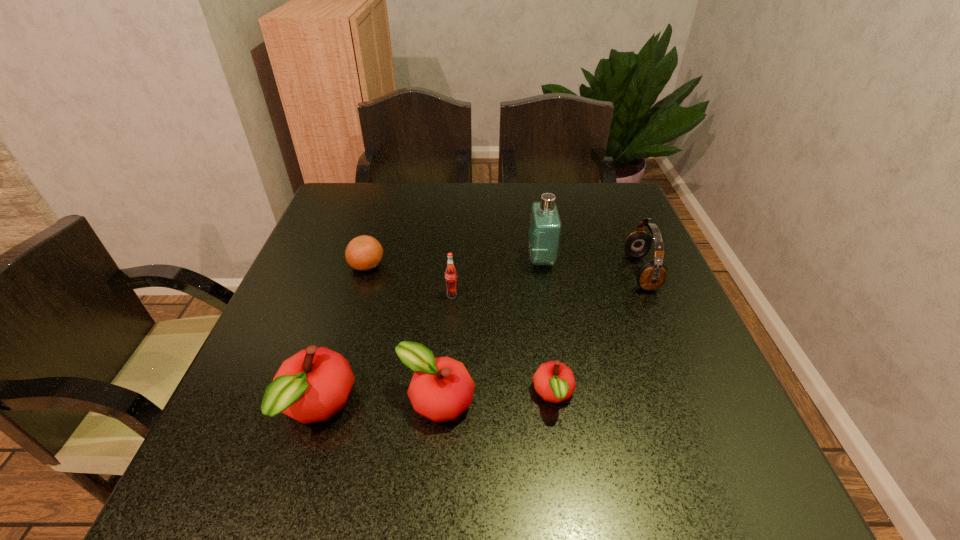
Where is `clementine that is at the left edge`? Image resolution: width=960 pixels, height=540 pixels. clementine that is at the left edge is located at coordinates (363, 253).

Locate an element on the screen. This screenshot has height=540, width=960. object located in the right edge section of the desktop is located at coordinates (652, 275).

Locate an element on the screen. Image resolution: width=960 pixels, height=540 pixels. object present at the near left corner is located at coordinates (311, 386).

The image size is (960, 540). Identify the location of free spot at the far edge of the desktop. (476, 204).

This screenshot has height=540, width=960. Identify the location of free space at the near edge. (492, 414).

Locate an element on the screen. free space at the left edge of the desktop is located at coordinates (334, 284).

Find the location of a particular element. Image resolution: width=960 pixels, height=540 pixels. blank space at the right edge is located at coordinates (662, 301).

You are a GUI agent. You are given a task and a screenshot of the screen. Output one action in this format:
    pyautogui.click(x=<x>, y=<y>)
    Task: Click on the vacant space at the far right corner of the desktop
    
    Given the screenshot: What is the action you would take?
    pyautogui.click(x=626, y=194)

In the image, there is a desktop. Where is `vacant region at the near right corner`? Image resolution: width=960 pixels, height=540 pixels. vacant region at the near right corner is located at coordinates (721, 412).

The height and width of the screenshot is (540, 960). In order to click on vacant space that is in between the soda bottle and the tallest object in this screenshot , I will do `click(496, 277)`.